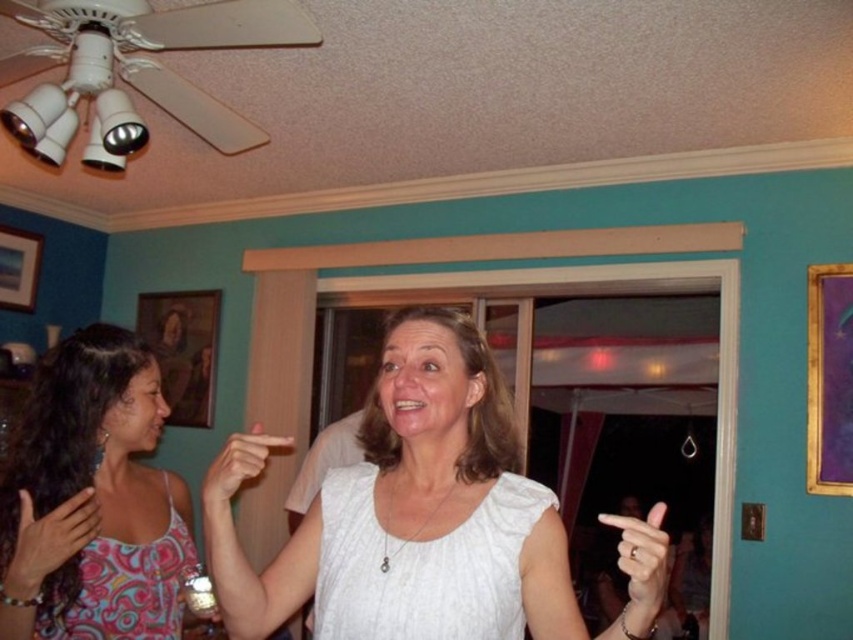
Question: Is matte pink tank top at center in front of matte pink hand at lower left?

Choices:
 (A) yes
 (B) no

Answer: (A)

Question: Can you confirm if matte pink hand at lower left is bigger than matte white hand at center?

Choices:
 (A) yes
 (B) no

Answer: (B)

Question: Which of the following is the closest to the observer?

Choices:
 (A) (402, 636)
 (B) (247, 477)

Answer: (A)

Question: Can you confirm if matte pink tank top at center is smaller than matte white hand at center?

Choices:
 (A) yes
 (B) no

Answer: (B)

Question: Among these objects, which one is nearest to the camera?

Choices:
 (A) white matte dress at center
 (B) white matte hand at center
 (C) matte white hand at center
 (D) matte pink hand at lower left

Answer: (A)

Question: Which object is positioned farthest from the matte pink tank top at center?

Choices:
 (A) matte pink hand at lower left
 (B) white matte dress at center
 (C) white matte hand at center
 (D) matte white hand at center

Answer: (C)